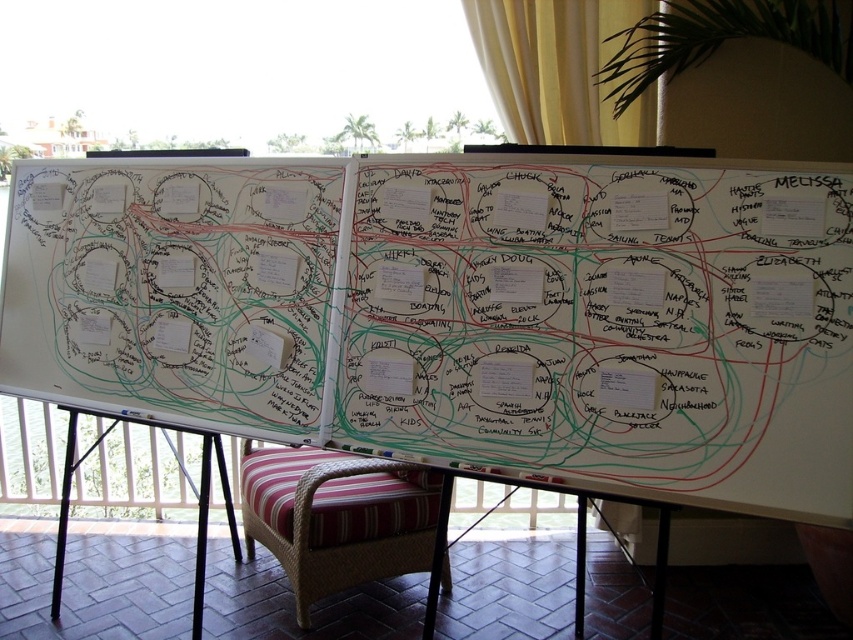
You are standing at the center of the room. You want to walk to the whiteboard at center. Which direction should you walk?

You are already at the whiteboard at center since you are standing at the center of the room, which is where the whiteboard at center is located according to its coordinates.

Based on the photo, you are organizing a community event and need to place a striped fabric cushion at lower center near the whiteboard at center. According to the image, where should you position the cushion relative to the whiteboard?

The whiteboard at center is positioned on the right side of striped fabric cushion at lower center, so the cushion should be placed to the left of the whiteboard at center.

From the picture: You are a person sitting on the striped fabric cushion at lower center. Looking at the whiteboards, can you see the name DAVID written on the whiteboard on your left?

The striped fabric cushion at lower center is located at point (335, 516). Since the whiteboards are placed side by side on easels near a balcony, and the cushion is at lower center, the name DAVID on the whiteboard on your left would be visible as the cushion is positioned in a central lower area allowing a clear view of both whiteboards.